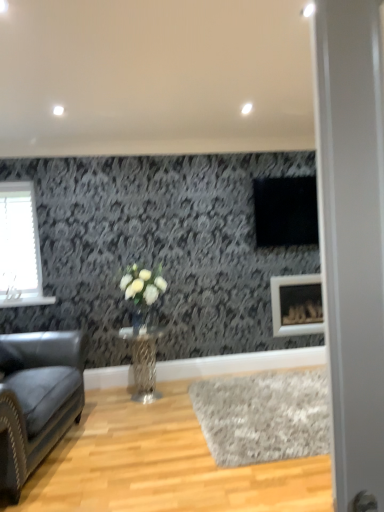
Question: Is leather couch at left not near gray shag rug at lower center?

Choices:
 (A) no
 (B) yes

Answer: (B)

Question: Is leather couch at left to the right of gray shag rug at lower center from the viewer's perspective?

Choices:
 (A) yes
 (B) no

Answer: (B)

Question: From a real-world perspective, does leather couch at left sit lower than gray shag rug at lower center?

Choices:
 (A) yes
 (B) no

Answer: (B)

Question: Is leather couch at left directly adjacent to gray shag rug at lower center?

Choices:
 (A) yes
 (B) no

Answer: (B)

Question: From the image's perspective, is leather couch at left beneath gray shag rug at lower center?

Choices:
 (A) yes
 (B) no

Answer: (B)

Question: Would you say gray shag rug at lower center is to the left or to the right of metallic textured table at center in the picture?

Choices:
 (A) right
 (B) left

Answer: (A)

Question: From a real-world perspective, is gray shag rug at lower center physically located above or below metallic textured table at center?

Choices:
 (A) above
 (B) below

Answer: (B)

Question: Does point click(x=268, y=420) appear closer or farther from the camera than point click(x=142, y=388)?

Choices:
 (A) farther
 (B) closer

Answer: (B)

Question: From the image's perspective, is gray shag rug at lower center above or below metallic textured table at center?

Choices:
 (A) below
 (B) above

Answer: (A)

Question: Is gray shag rug at lower center taller or shorter than clear glass vase at center?

Choices:
 (A) tall
 (B) short

Answer: (B)

Question: In the image, is gray shag rug at lower center positioned in front of or behind clear glass vase at center?

Choices:
 (A) front
 (B) behind

Answer: (A)

Question: From a real-world perspective, is gray shag rug at lower center physically located above or below clear glass vase at center?

Choices:
 (A) below
 (B) above

Answer: (A)

Question: Visually, is gray shag rug at lower center positioned to the left or to the right of clear glass vase at center?

Choices:
 (A) right
 (B) left

Answer: (A)

Question: In the image, is transparent glass door at right positioned in front of or behind metallic textured table at center?

Choices:
 (A) front
 (B) behind

Answer: (A)

Question: Looking at the image, does transparent glass door at right seem bigger or smaller compared to metallic textured table at center?

Choices:
 (A) big
 (B) small

Answer: (B)